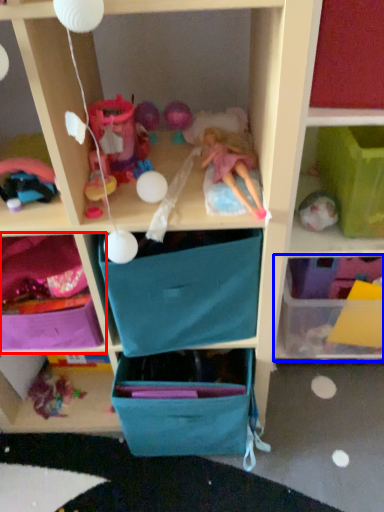
Question: Which of the following is the closest to the observer, shelf (highlighted by a red box) or shelf (highlighted by a blue box)?

Choices:
 (A) shelf
 (B) shelf

Answer: (A)